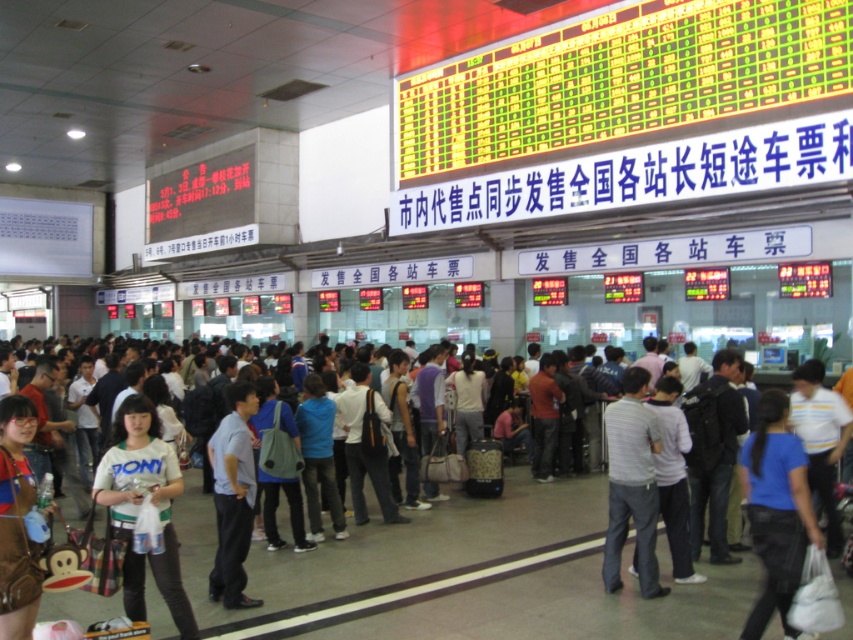
Which is more to the left, blue cotton shirt at center or denim jacket at lower left?

denim jacket at lower left is more to the left.

Does blue cotton shirt at center have a smaller size compared to denim jacket at lower left?

No.

The image size is (853, 640). What do you see at coordinates (776, 509) in the screenshot?
I see `blue cotton shirt at center` at bounding box center [776, 509].

Locate an element on the screen. blue cotton shirt at center is located at coordinates (776, 509).